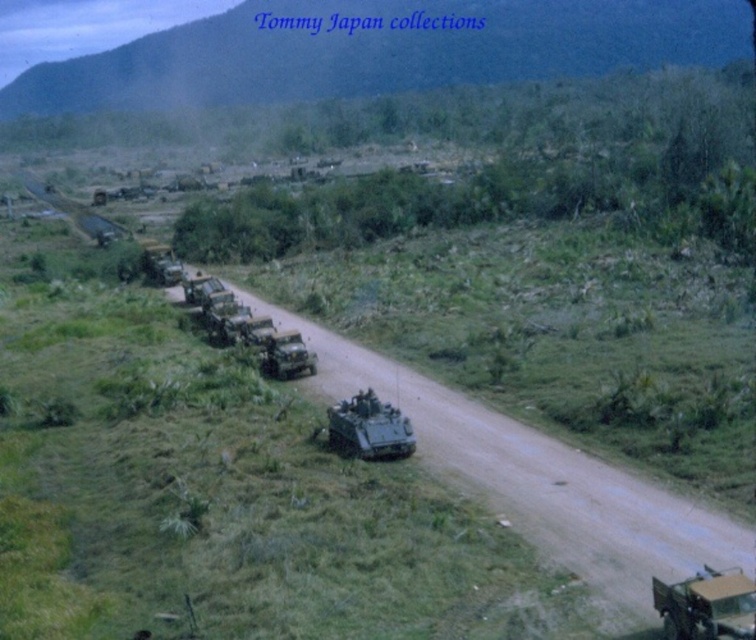
Can you confirm if matte green jeep at center is taller than matte green armored vehicle at center?

Indeed, matte green jeep at center has a greater height compared to matte green armored vehicle at center.

Measure the distance from matte green jeep at center to matte green armored vehicle at center.

matte green jeep at center is 15.36 meters away from matte green armored vehicle at center.

Is point (299, 348) farther from viewer compared to point (211, 278)?

No, it is in front of (211, 278).

Identify the location of matte green jeep at center. (287, 355).

Does brown dirt track at center have a larger size compared to matte green tank at center?

Yes, brown dirt track at center is bigger than matte green tank at center.

Find the location of `brown dirt track at center`. brown dirt track at center is located at coordinates (215, 490).

Where is `brown dirt track at center`? The height and width of the screenshot is (640, 756). brown dirt track at center is located at coordinates (215, 490).

Which is behind, point (290, 346) or point (169, 273)?

The point (169, 273) is more distant.

Is matte green jeep at center to the right of green matte military truck at center from the viewer's perspective?

Yes, matte green jeep at center is to the right of green matte military truck at center.

Who is more forward, (280, 362) or (172, 259)?

Point (280, 362) is in front.

At what (x,y) coordinates should I click in order to perform the action: click on matte green jeep at center. Please return your answer as a coordinate pair (x, y). This screenshot has width=756, height=640. Looking at the image, I should click on (287, 355).